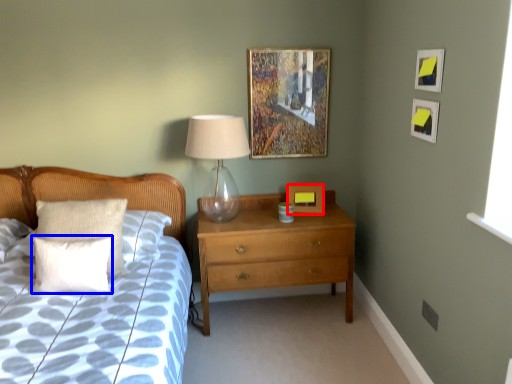
Question: Which object is closer to the camera taking this photo, picture frame (highlighted by a red box) or pillow (highlighted by a blue box)?

Choices:
 (A) picture frame
 (B) pillow

Answer: (B)